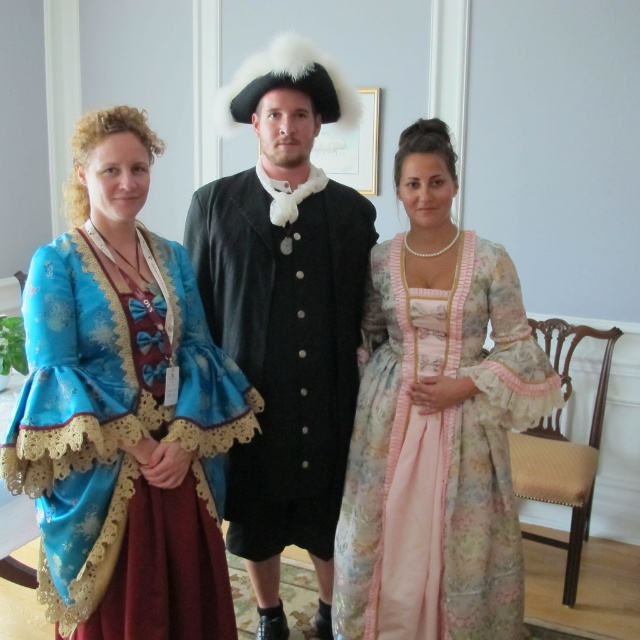
Can you confirm if black satin coat at center is taller than floral silk dress at center?

Yes.

From the picture: Is black satin coat at center to the right of floral silk dress at center from the viewer's perspective?

Incorrect, black satin coat at center is not on the right side of floral silk dress at center.

Describe the element at coordinates (285, 314) in the screenshot. This screenshot has width=640, height=640. I see `black satin coat at center` at that location.

Where is `black satin coat at center`? black satin coat at center is located at coordinates (285, 314).

Is matte blue fabric dress at left smaller than floral silk dress at center?

Incorrect, matte blue fabric dress at left is not smaller in size than floral silk dress at center.

Does point (177, 538) come in front of point (387, 278)?

Yes, it is in front of point (387, 278).

Is point (36, 387) in front of point (412, 432)?

Yes, point (36, 387) is in front of point (412, 432).

In order to click on matte blue fabric dress at left in this screenshot , I will do `click(124, 410)`.

Who is lower down, matte blue fabric dress at left or black satin coat at center?

Positioned lower is black satin coat at center.

Looking at this image, who is positioned more to the left, matte blue fabric dress at left or black satin coat at center?

matte blue fabric dress at left is more to the left.

The height and width of the screenshot is (640, 640). What are the coordinates of `matte blue fabric dress at left` in the screenshot? It's located at (124, 410).